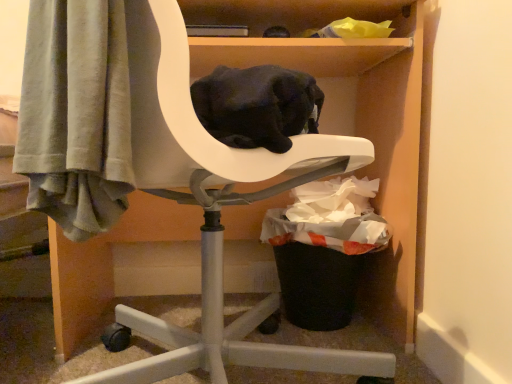
Question: Does white plastic chair at center have a greater width compared to black plastic trash can at lower right?

Choices:
 (A) no
 (B) yes

Answer: (B)

Question: Is white plastic chair at center at the left side of black plastic trash can at lower right?

Choices:
 (A) no
 (B) yes

Answer: (B)

Question: Is white plastic chair at center bigger than black plastic trash can at lower right?

Choices:
 (A) yes
 (B) no

Answer: (A)

Question: From a real-world perspective, is white plastic chair at center physically below black plastic trash can at lower right?

Choices:
 (A) yes
 (B) no

Answer: (B)

Question: Does white plastic chair at center have a lesser height compared to black plastic trash can at lower right?

Choices:
 (A) yes
 (B) no

Answer: (B)

Question: Considering the relative sizes of white plastic chair at center and black plastic trash can at lower right in the image provided, is white plastic chair at center thinner than black plastic trash can at lower right?

Choices:
 (A) no
 (B) yes

Answer: (A)

Question: From the image's perspective, is black plastic trash can at lower right above white plastic chair at center?

Choices:
 (A) yes
 (B) no

Answer: (B)

Question: Is black plastic trash can at lower right placed right next to white plastic chair at center?

Choices:
 (A) yes
 (B) no

Answer: (B)

Question: Can you confirm if black plastic trash can at lower right is bigger than white plastic chair at center?

Choices:
 (A) no
 (B) yes

Answer: (A)

Question: From a real-world perspective, is black plastic trash can at lower right located higher than white plastic chair at center?

Choices:
 (A) yes
 (B) no

Answer: (B)

Question: Is black plastic trash can at lower right facing away from white plastic chair at center?

Choices:
 (A) no
 (B) yes

Answer: (B)

Question: Considering the relative sizes of black plastic trash can at lower right and white plastic chair at center in the image provided, is black plastic trash can at lower right shorter than white plastic chair at center?

Choices:
 (A) yes
 (B) no

Answer: (A)

Question: From a real-world perspective, is black plastic trash can at lower right physically located above or below white plastic chair at center?

Choices:
 (A) below
 (B) above

Answer: (A)